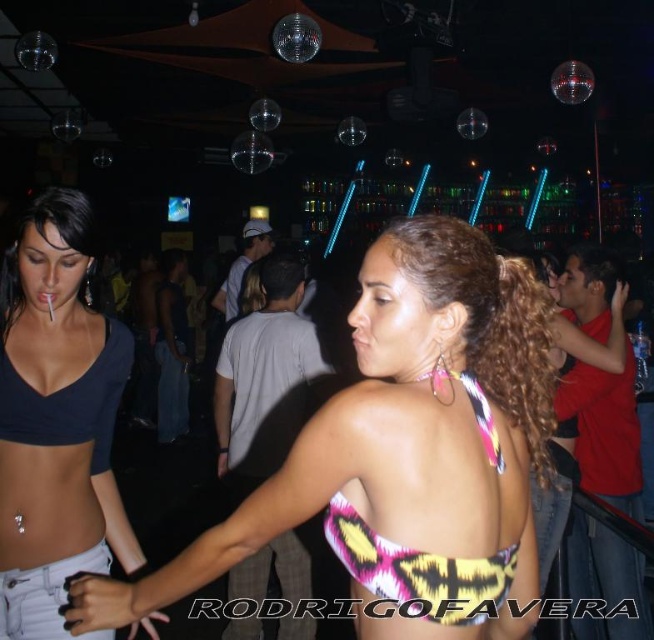
Question: Which object is positioned closest to the matte black top at left?

Choices:
 (A) multicolored fabric bikini top at center
 (B) yellow and pink patterned bikini top at back

Answer: (B)

Question: Which of the following is the farthest from the observer?

Choices:
 (A) yellow and pink patterned bikini top at back
 (B) matte black top at left

Answer: (B)

Question: Can you confirm if printed fabric bikini top at center is thinner than multicolored fabric bikini top at center?

Choices:
 (A) no
 (B) yes

Answer: (A)

Question: Considering the real-world distances, which object is closest to the multicolored fabric bikini top at center?

Choices:
 (A) yellow and pink patterned bikini top at back
 (B) matte black top at left
 (C) printed fabric bikini top at center

Answer: (C)

Question: Is printed fabric bikini top at center smaller than multicolored fabric bikini top at center?

Choices:
 (A) no
 (B) yes

Answer: (A)

Question: Is printed fabric bikini top at center below yellow and pink patterned bikini top at back?

Choices:
 (A) no
 (B) yes

Answer: (B)